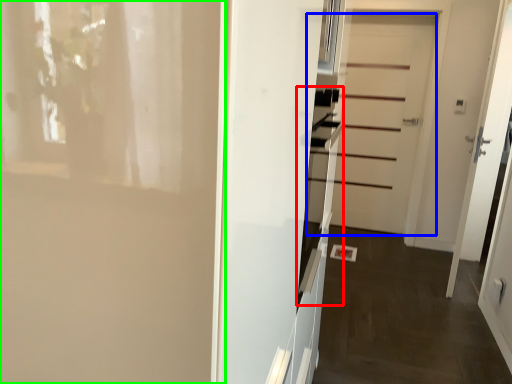
Question: Which object is the farthest from oven (highlighted by a red box)? Choose among these: door (highlighted by a blue box) or door (highlighted by a green box).

Choices:
 (A) door
 (B) door

Answer: (A)